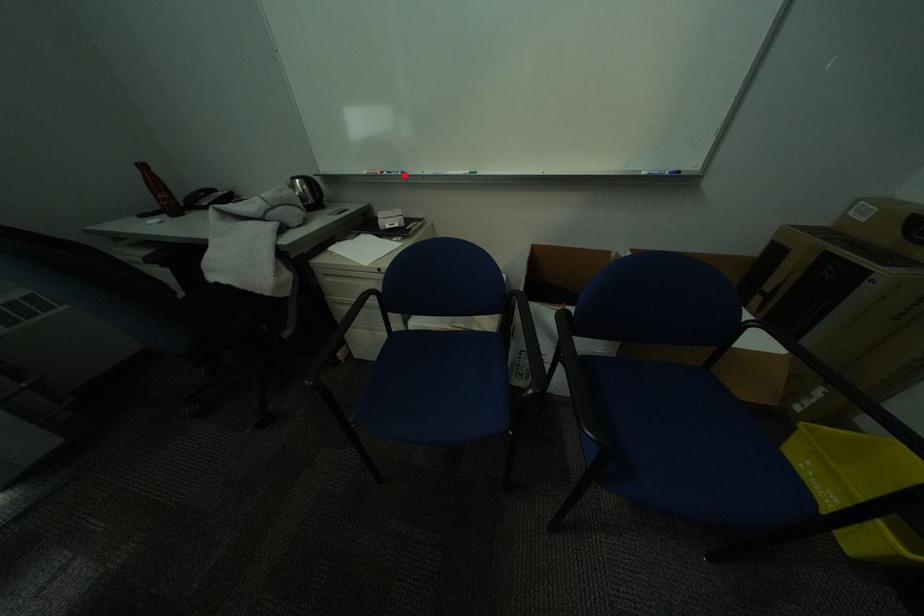
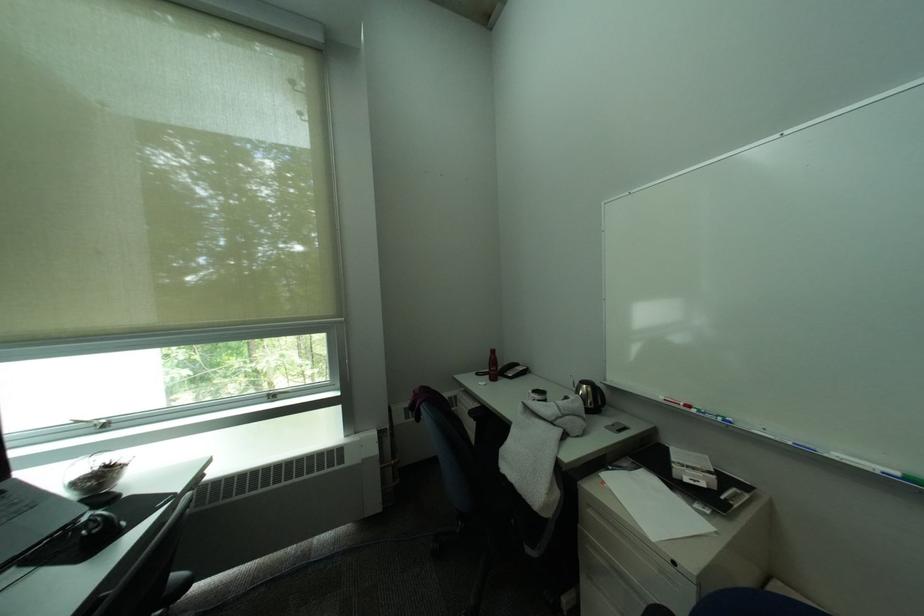
Question: I am providing you with two images of the same scene from different viewpoints. Given a red point in image1, look at the same physical point in image2. Is it:

Choices:
 (A) Closer to the viewpoint
 (B) Farther from the viewpoint

Answer: (B)